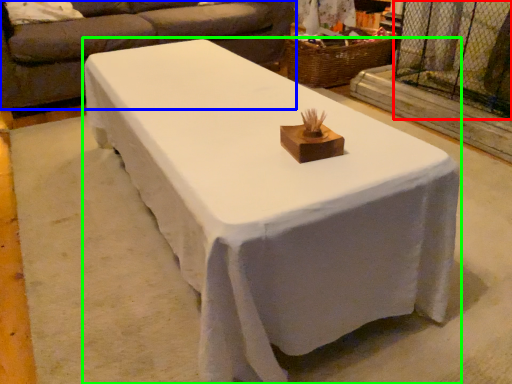
Question: Based on their relative distances, which object is nearer to screen door (highlighted by a red box)? Choose from studio couch (highlighted by a blue box) and table (highlighted by a green box).

Choices:
 (A) studio couch
 (B) table

Answer: (A)